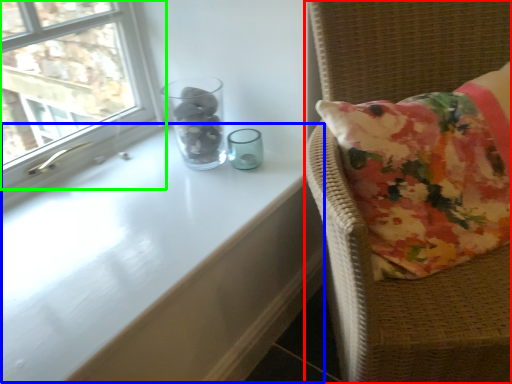
Question: Considering the real-world distances, which object is farthest from furniture (highlighted by a red box)? table (highlighted by a blue box) or window (highlighted by a green box)?

Choices:
 (A) table
 (B) window

Answer: (B)